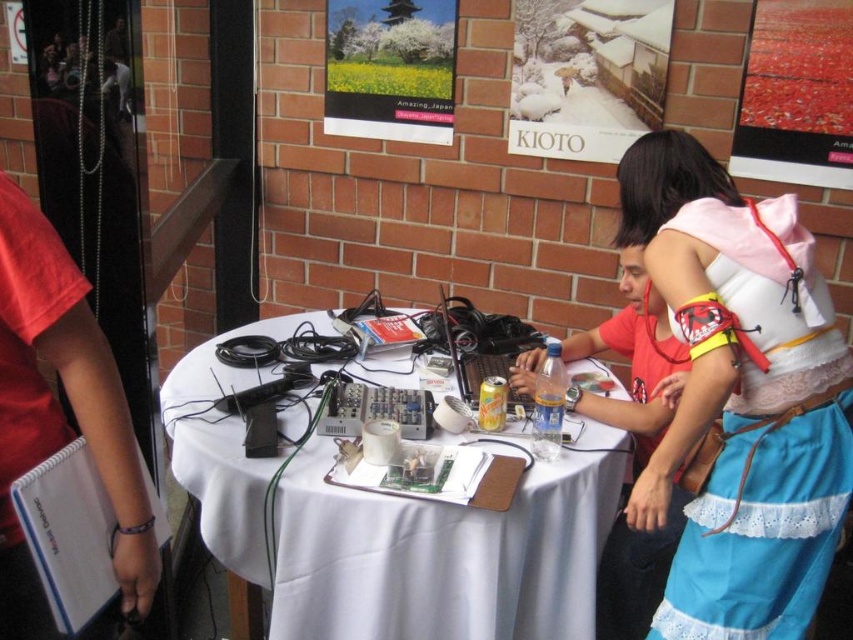
Who is more distant from viewer, (691, 305) or (831, 17)?

Positioned behind is point (831, 17).

Locate an element on the screen. white lace fabric skirt at lower right is located at coordinates (740, 396).

Does white lace fabric skirt at lower right appear on the right side of snow-covered wooden house at upper center?

Correct, you'll find white lace fabric skirt at lower right to the right of snow-covered wooden house at upper center.

Does white lace fabric skirt at lower right appear over snow-covered wooden house at upper center?

Actually, white lace fabric skirt at lower right is below snow-covered wooden house at upper center.

Which is in front, point (804, 305) or point (515, 60)?

Point (804, 305) is more forward.

The image size is (853, 640). Find the location of `white lace fabric skirt at lower right`. white lace fabric skirt at lower right is located at coordinates (740, 396).

Is white lace fabric skirt at lower right to the left of white cloth-covered table at center from the viewer's perspective?

In fact, white lace fabric skirt at lower right is to the right of white cloth-covered table at center.

The height and width of the screenshot is (640, 853). What are the coordinates of `white lace fabric skirt at lower right` in the screenshot? It's located at (740, 396).